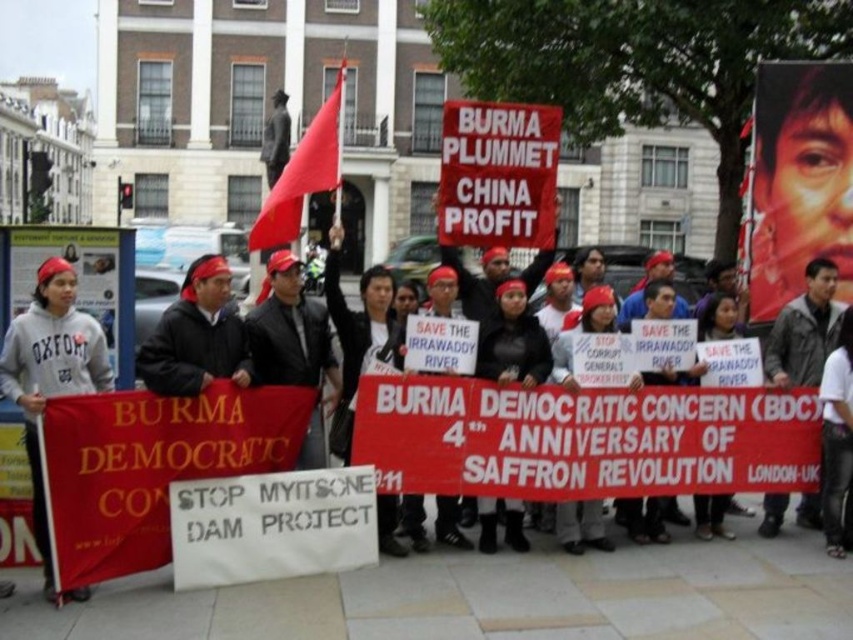
You are a photographer at the protest scene. You want to capture a photo of the dark gray leather jacket at center and the black fabric at center. Which object is wider in the image?

The dark gray leather jacket at center might be wider than black fabric at center according to the description.

You are a photographer at the protest scene. You need to capture a photo that includes both the dark gray leather jacket at center and the black fabric at center. Which object should you focus on to ensure both are in frame without zooming in or out?

You should focus on the dark gray leather jacket at center because it is bigger than the black fabric at center, so keeping it centered will allow the smaller black fabric at center to remain in the frame without needing to adjust the zoom.